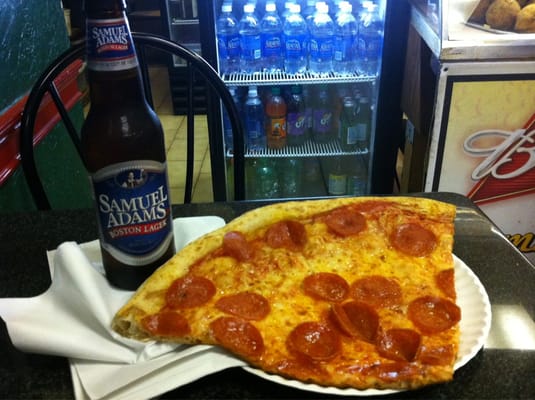
I want to click on chair back, so [x=198, y=60].